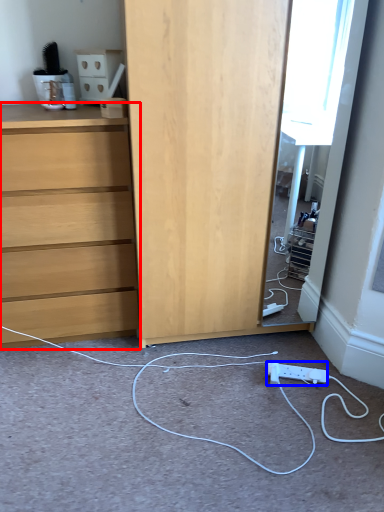
Question: Which of the following is the closest to the observer, chest of drawers (highlighted by a red box) or electric outlet (highlighted by a blue box)?

Choices:
 (A) chest of drawers
 (B) electric outlet

Answer: (A)